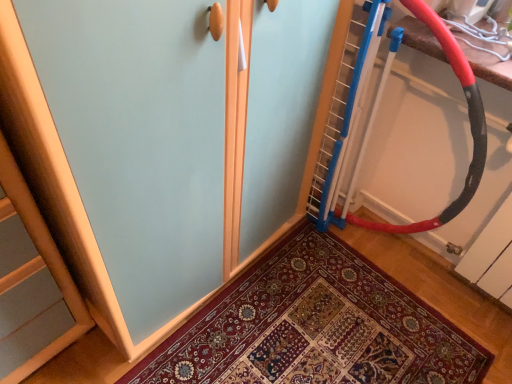
Locate an element on the screen. Image resolution: width=512 pixels, height=384 pixels. vacant space situated on the left part of red rubber garden hose at right is located at coordinates (300, 268).